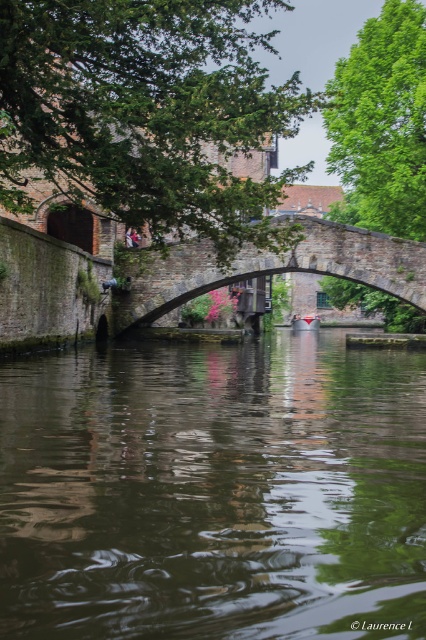
Question: Observing the image, what is the correct spatial positioning of green reflective water at center in reference to stone arch bridge at center?

Choices:
 (A) right
 (B) left

Answer: (B)

Question: Considering the real-world distances, which object is closest to the green reflective water at center?

Choices:
 (A) matte red boat at center
 (B) stone arch bridge at center

Answer: (B)

Question: In this image, where is green reflective water at center located relative to stone arch bridge at center?

Choices:
 (A) above
 (B) below

Answer: (B)

Question: Based on their relative distances, which object is nearer to the matte red boat at center?

Choices:
 (A) green reflective water at center
 (B) stone arch bridge at center

Answer: (B)

Question: Can you confirm if stone arch bridge at center is positioned to the left of matte red boat at center?

Choices:
 (A) no
 (B) yes

Answer: (B)

Question: Which point appears closest to the camera in this image?

Choices:
 (A) (411, 246)
 (B) (42, 636)

Answer: (B)